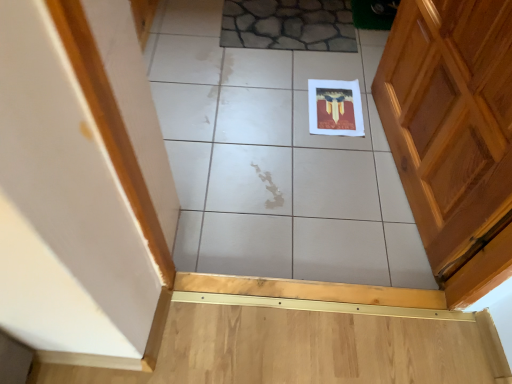
Locate an element on the screen. free space to the left of stone-like ceramic tile at upper center, positioned as the 2th ceramic tile in bottom-to-top order is located at coordinates (188, 39).